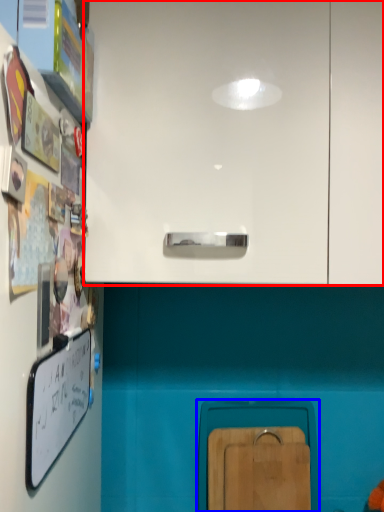
Question: Which point is closer to the camera, cabinetry (highlighted by a red box) or cabinetry (highlighted by a blue box)?

Choices:
 (A) cabinetry
 (B) cabinetry

Answer: (A)